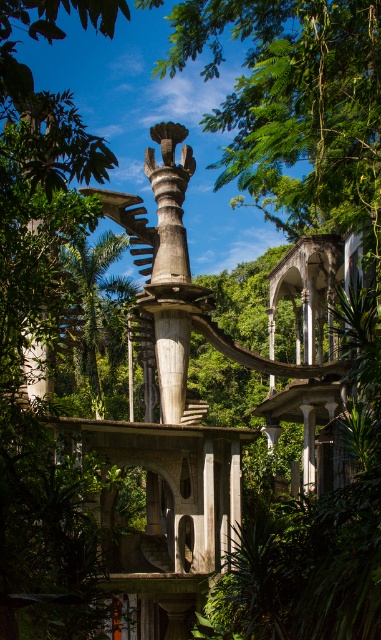
Which is more to the right, wooden sculpture at center or green leafy tree at center?

From the viewer's perspective, wooden sculpture at center appears more on the right side.

Looking at this image, who is taller, wooden sculpture at center or green leafy tree at center?

With more height is wooden sculpture at center.

Between point (185, 264) and point (97, 316), which one is positioned behind?

Point (97, 316)

Identify the location of wooden sculpture at center. The image size is (381, 640). (169, 276).